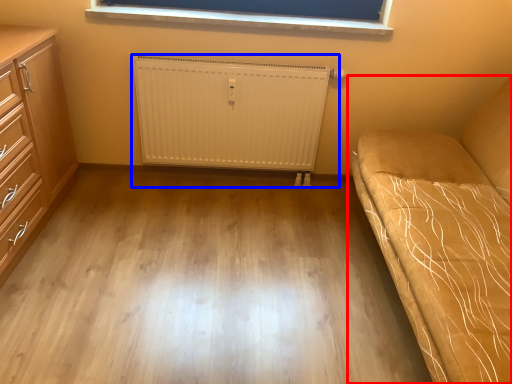
Question: Which point is further to the camera, studio couch (highlighted by a red box) or radiator (highlighted by a blue box)?

Choices:
 (A) studio couch
 (B) radiator

Answer: (B)